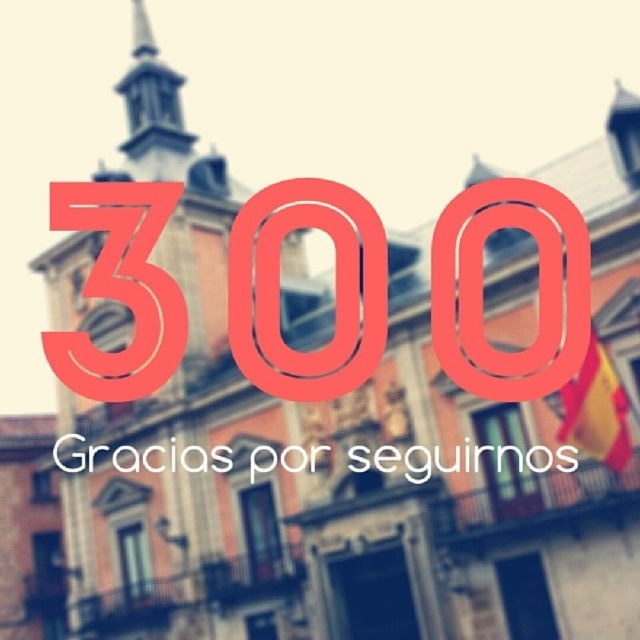
Does metallic red number at center have a greater height compared to smooth stone spire at upper left?

No.

Does metallic red number at center appear on the right side of smooth stone spire at upper left?

Correct, you'll find metallic red number at center to the right of smooth stone spire at upper left.

You are a GUI agent. You are given a task and a screenshot of the screen. Output one action in this format:
    pyautogui.click(x=<x>, y=<y>)
    Task: Click on the metallic red number at center
    The width and height of the screenshot is (640, 640).
    Given the screenshot: What is the action you would take?
    pyautogui.click(x=278, y=289)